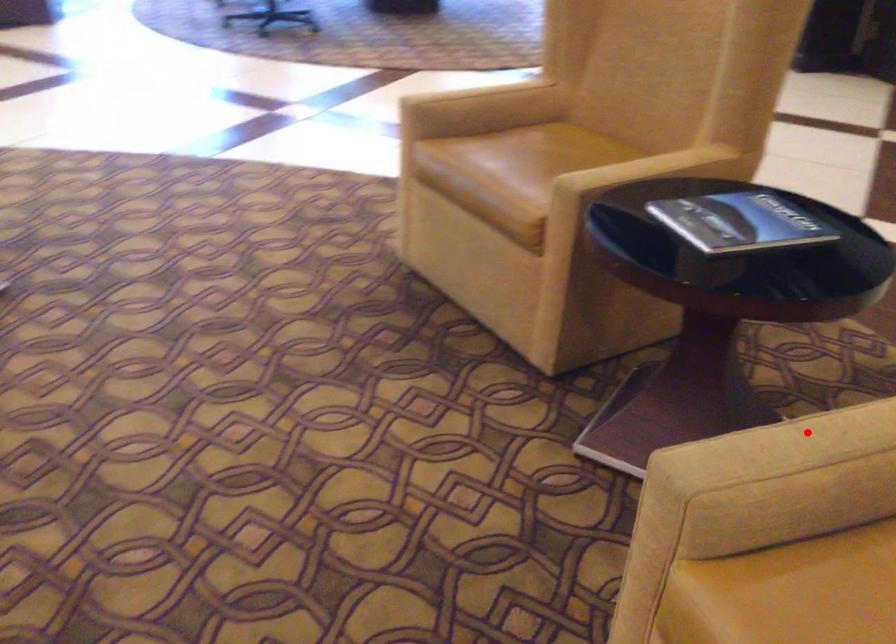
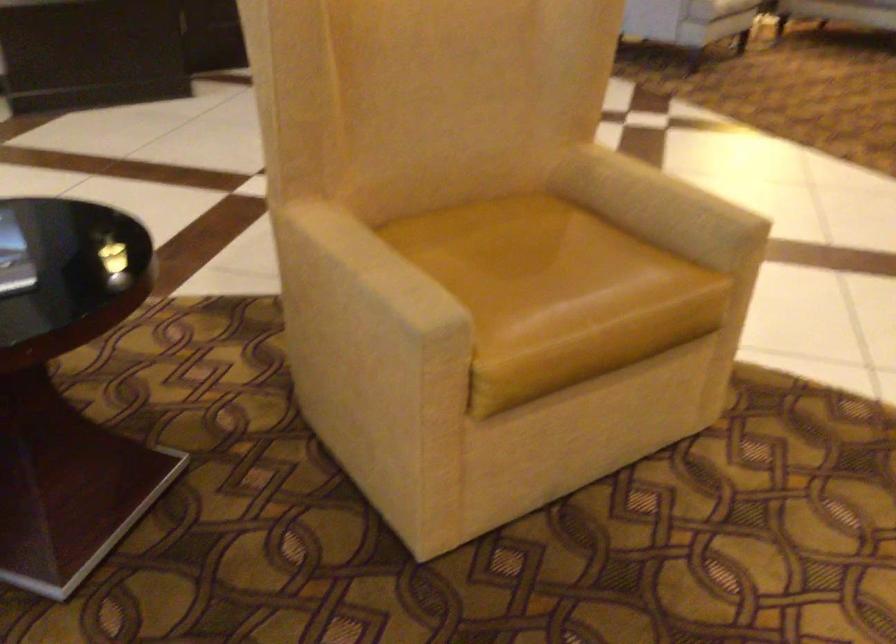
Question: I am providing you with two images of the same scene from different viewpoints. In image1, a red point is highlighted. Considering the same 3D point in image2, which of the following is correct?

Choices:
 (A) It is closer
 (B) It is farther

Answer: (B)